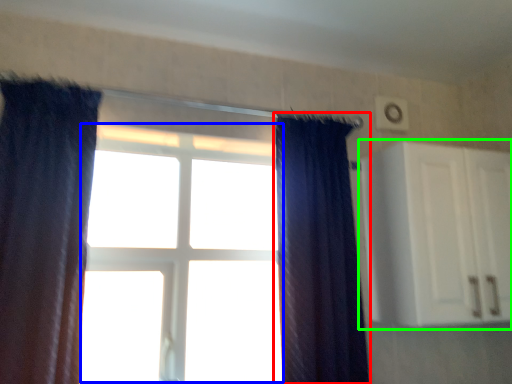
Question: Considering the real-world distances, which object is closest to curtain (highlighted by a red box)? bay window (highlighted by a blue box) or cabinetry (highlighted by a green box).

Choices:
 (A) bay window
 (B) cabinetry

Answer: (B)